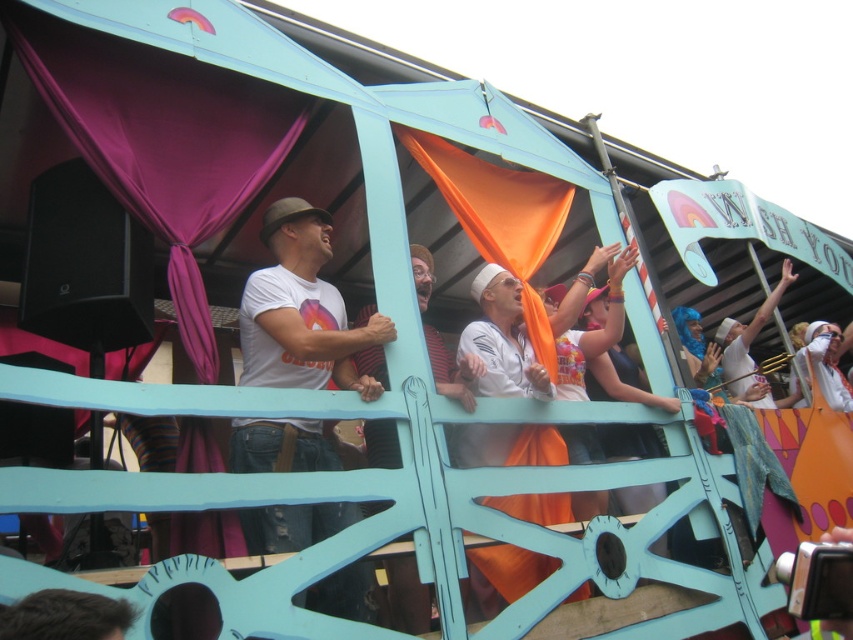
Question: Among these objects, which one is nearest to the camera?

Choices:
 (A) white t-shirt at center
 (B) matte white shirt at center

Answer: (A)

Question: Which of the following is the farthest from the observer?

Choices:
 (A) (418, 276)
 (B) (503, 442)
 (C) (247, 536)

Answer: (A)

Question: Does white t-shirt at center appear on the left side of matte white shirt at center?

Choices:
 (A) no
 (B) yes

Answer: (B)

Question: Which point appears closest to the camera in this image?

Choices:
 (A) (415, 586)
 (B) (274, 371)

Answer: (B)

Question: Is white t-shirt at center closer to the viewer compared to white matte shirt at center?

Choices:
 (A) no
 (B) yes

Answer: (B)

Question: Observing the image, what is the correct spatial positioning of white t-shirt at center in reference to white matte shirt at center?

Choices:
 (A) left
 (B) right

Answer: (A)